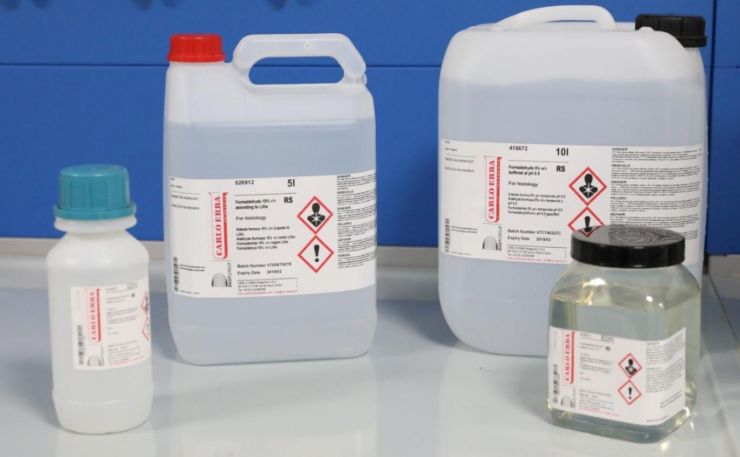
The image size is (740, 457). In order to click on glass bottle in this screenshot , I will do [x=659, y=282].